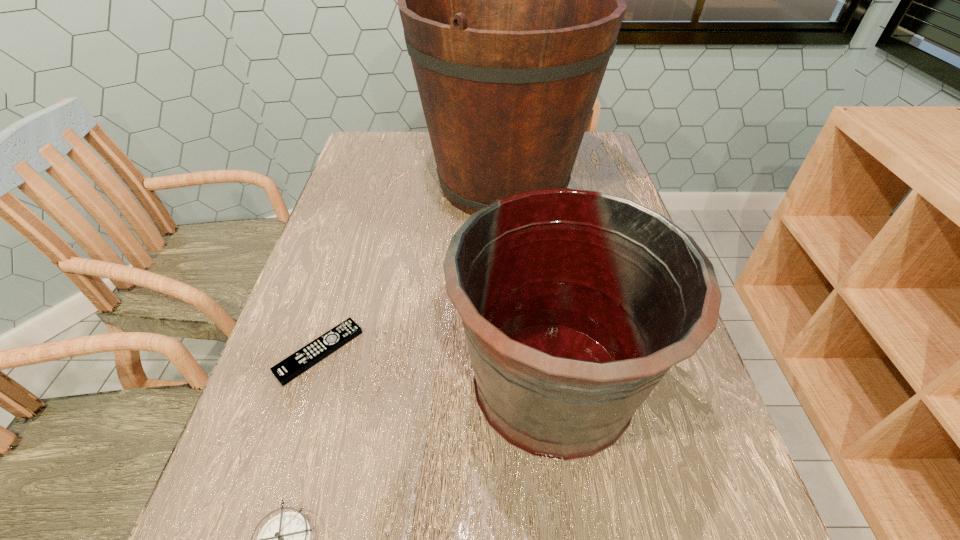
What are the coordinates of `the tallest object` in the screenshot? It's located at (511, 0).

Find the location of a particular element. The image size is (960, 540). the taller bucket is located at coordinates (511, 0).

Find the location of a particular element. This screenshot has height=540, width=960. the second tallest object is located at coordinates (575, 303).

Locate an element on the screen. the shorter bucket is located at coordinates (575, 303).

You are a GUI agent. You are given a task and a screenshot of the screen. Output one action in this format:
    pyautogui.click(x=<x>, y=<y>)
    Task: Click on the shortest object
    
    Given the screenshot: What is the action you would take?
    click(x=291, y=367)

Identify the location of vacant region located 0.230m on the front of the farthest object. (512, 310).

This screenshot has height=540, width=960. Identify the location of vacant region located on the back of the nearer bucket. (534, 232).

The height and width of the screenshot is (540, 960). I want to click on vacant space located on the right of the remote control, so click(x=512, y=352).

Where is `object that is at the far edge`? The height and width of the screenshot is (540, 960). object that is at the far edge is located at coordinates (511, 0).

The height and width of the screenshot is (540, 960). In order to click on object situated at the left edge in this screenshot , I will do `click(291, 367)`.